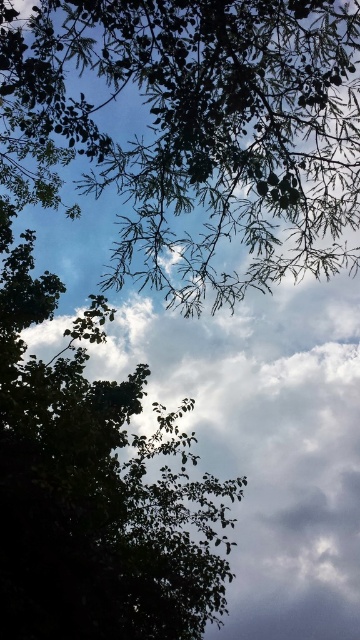
You are standing under a tree and looking up. You see the green leafy branches at upper center and the green leafy tree at center. Which one is taller?

The green leafy branches at upper center is taller than the green leafy tree at center according to the description.

You are standing under the tree canopy and looking up. Which object is higher in the scene between the green leafy branches at upper center and the green leafy tree at center?

The green leafy branches at upper center are higher than the green leafy tree at center because they are positioned above it.

You are a bird flying at an altitude of 5 feet. You see the green leafy branches at upper center and the green leafy tree at center. Can you safely land between them without hitting either?

The distance between the green leafy branches at upper center and the green leafy tree at center is 7.61 feet. Since you are flying at 5 feet altitude, you can safely land between them as the vertical space is sufficient.